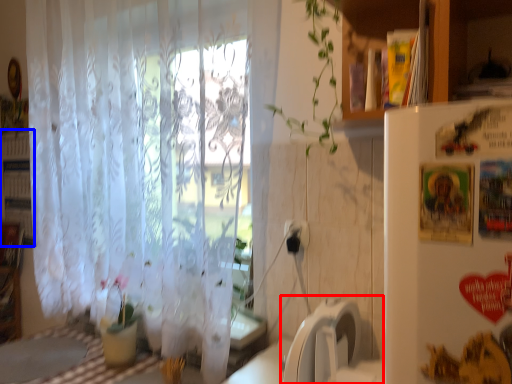
Question: Among these objects, which one is farthest to the camera, washing machine (highlighted by a red box) or bookshelf (highlighted by a blue box)?

Choices:
 (A) washing machine
 (B) bookshelf

Answer: (B)